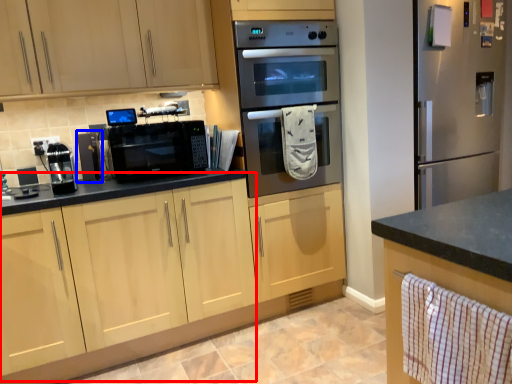
Question: Which point is closer to the camera, cabinetry (highlighted by a red box) or appliance (highlighted by a blue box)?

Choices:
 (A) cabinetry
 (B) appliance

Answer: (A)